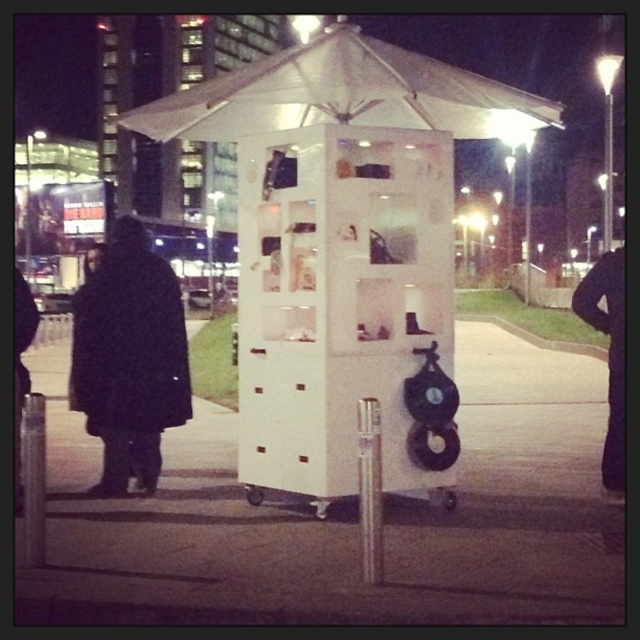
You are a city planner evaluating the placement of the white matte cart at center and the black matte coat at left in a public space. Considering their heights, which object might block the view of pedestrians walking by more?

The black matte coat at left is taller than the white matte cart at center, so it might block the view of pedestrians more.